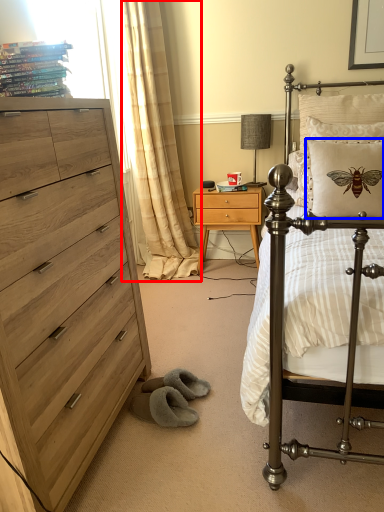
Question: Among these objects, which one is nearest to the camera, curtain (highlighted by a red box) or pillow (highlighted by a blue box)?

Choices:
 (A) curtain
 (B) pillow

Answer: (B)